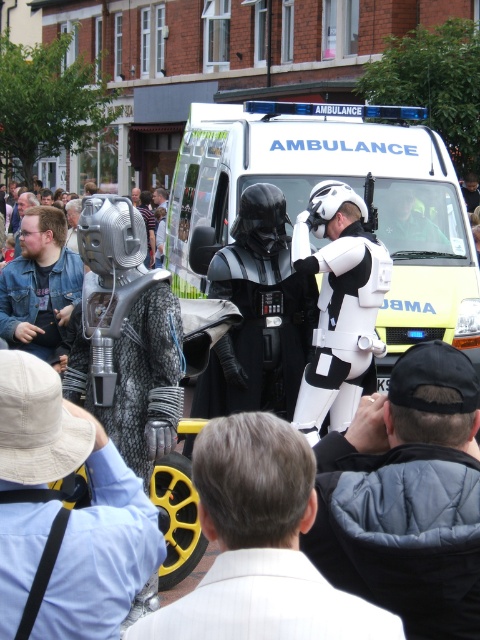
Question: Which object is farther from the camera taking this photo?

Choices:
 (A) yellow/white plastic ambulance at center
 (B) white matte helmet at center

Answer: (A)

Question: Which of the following is the closest to the observer?

Choices:
 (A) white matte helmet at center
 (B) denim jacket at left
 (C) light brown textured coat at center

Answer: (C)

Question: Is white matte helmet at center positioned in front of light brown textured coat at center?

Choices:
 (A) no
 (B) yes

Answer: (A)

Question: Which object is the farthest from the light brown textured coat at center?

Choices:
 (A) yellow/white plastic ambulance at center
 (B) black matte helmet at center

Answer: (A)

Question: In this image, where is light brown textured coat at center located relative to white textured suit at center?

Choices:
 (A) left
 (B) right

Answer: (B)

Question: Observing the image, what is the correct spatial positioning of light brown textured coat at center in reference to denim jacket at left?

Choices:
 (A) below
 (B) above

Answer: (A)